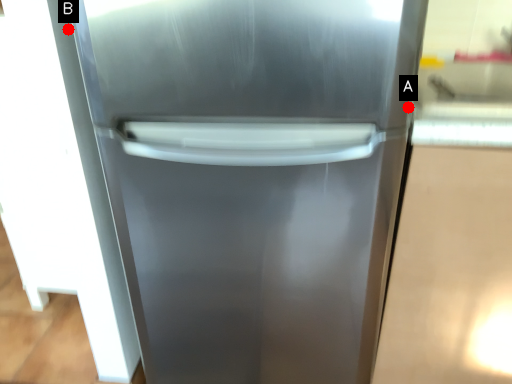
Question: Two points are circled on the image, labeled by A and B beside each circle. Which point is further to the camera?

Choices:
 (A) A is further
 (B) B is further

Answer: (B)